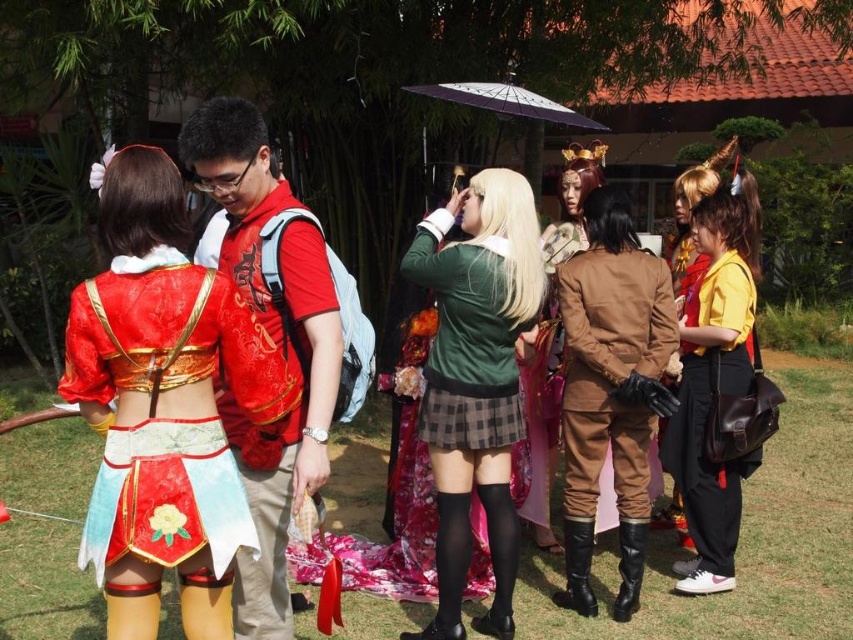
Question: Does green velvet jacket at center have a greater width compared to black leather boots at lower center?

Choices:
 (A) yes
 (B) no

Answer: (A)

Question: Which point is farther to the camera?

Choices:
 (A) (109, 436)
 (B) (463, 97)
 (C) (579, 259)
 (D) (628, 604)

Answer: (B)

Question: Is yellow matte jacket at right to the left of black leather boots at lower center from the viewer's perspective?

Choices:
 (A) no
 (B) yes

Answer: (A)

Question: In this image, where is brown leather jacket at center located relative to purple matte umbrella at upper center?

Choices:
 (A) left
 (B) right

Answer: (B)

Question: Which point appears closest to the camera in this image?

Choices:
 (A) (622, 612)
 (B) (215, 324)
 (C) (454, 328)

Answer: (B)

Question: Which of the following is the closest to the observer?

Choices:
 (A) (592, 520)
 (B) (607, 292)

Answer: (B)